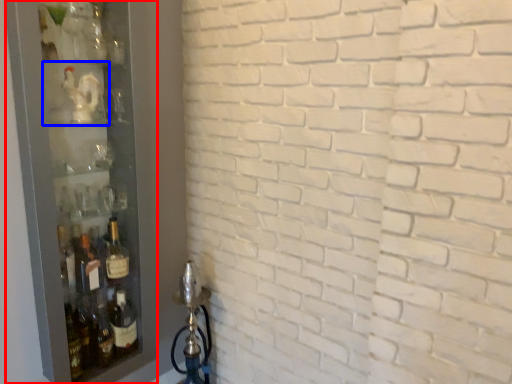
Question: Which object appears farthest to the camera in this image, glass door (highlighted by a red box) or shelf (highlighted by a blue box)?

Choices:
 (A) glass door
 (B) shelf

Answer: (B)